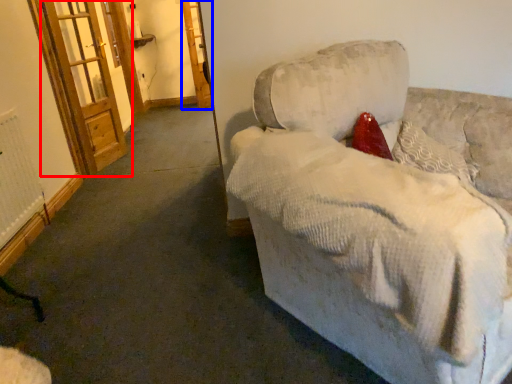
Question: Which object is closer to the camera taking this photo, screen door (highlighted by a red box) or screen door (highlighted by a blue box)?

Choices:
 (A) screen door
 (B) screen door

Answer: (A)